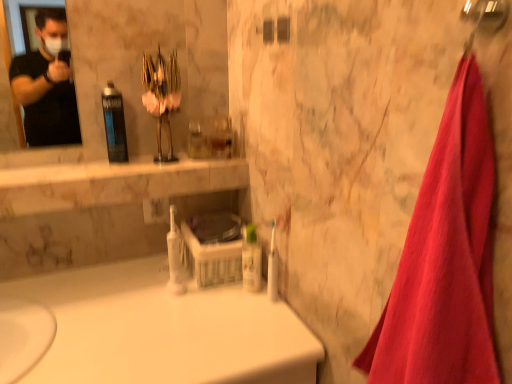
Question: Would you say translucent plastic mouthwash at center, placed as the 1th mouthwash when sorted from left to right, contains red cotton towel at right?

Choices:
 (A) no
 (B) yes

Answer: (A)

Question: Is translucent plastic mouthwash at center, placed as the 1th mouthwash when sorted from left to right, to the left of red cotton towel at right from the viewer's perspective?

Choices:
 (A) no
 (B) yes

Answer: (B)

Question: Does translucent plastic mouthwash at center, which is the third mouthwash in bottom-to-top order, have a greater width compared to red cotton towel at right?

Choices:
 (A) yes
 (B) no

Answer: (B)

Question: Considering the relative sizes of translucent plastic mouthwash at center, the first mouthwash when ordered from top to bottom, and red cotton towel at right in the image provided, is translucent plastic mouthwash at center, the first mouthwash when ordered from top to bottom, smaller than red cotton towel at right?

Choices:
 (A) yes
 (B) no

Answer: (A)

Question: From the image's perspective, would you say translucent plastic mouthwash at center, the first mouthwash when ordered from top to bottom, is positioned over red cotton towel at right?

Choices:
 (A) yes
 (B) no

Answer: (A)

Question: Would you say translucent plastic mouthwash at center, which is the 3th mouthwash in right-to-left order, is outside red cotton towel at right?

Choices:
 (A) no
 (B) yes

Answer: (B)

Question: Is translucent plastic mouthwash at center, which is the third mouthwash in bottom-to-top order, at the right side of white plastic toothbrush at center?

Choices:
 (A) yes
 (B) no

Answer: (B)

Question: From a real-world perspective, is translucent plastic mouthwash at center, which is the third mouthwash in bottom-to-top order, over white plastic toothbrush at center?

Choices:
 (A) yes
 (B) no

Answer: (A)

Question: Is translucent plastic mouthwash at center, the first mouthwash when ordered from top to bottom, not inside white plastic toothbrush at center?

Choices:
 (A) yes
 (B) no

Answer: (A)

Question: Is the position of translucent plastic mouthwash at center, the first mouthwash when ordered from top to bottom, more distant than that of white plastic toothbrush at center?

Choices:
 (A) no
 (B) yes

Answer: (B)

Question: Can you confirm if translucent plastic mouthwash at center, placed as the 1th mouthwash when sorted from left to right, is positioned to the left of white plastic toothbrush at center?

Choices:
 (A) no
 (B) yes

Answer: (B)

Question: Can you confirm if translucent plastic mouthwash at center, the first mouthwash when ordered from top to bottom, is smaller than white plastic toothbrush at center?

Choices:
 (A) no
 (B) yes

Answer: (A)

Question: From a real-world perspective, is translucent plastic mouthwash at center, the first mouthwash when ordered from top to bottom, positioned over white glossy bathtub at center based on gravity?

Choices:
 (A) no
 (B) yes

Answer: (B)